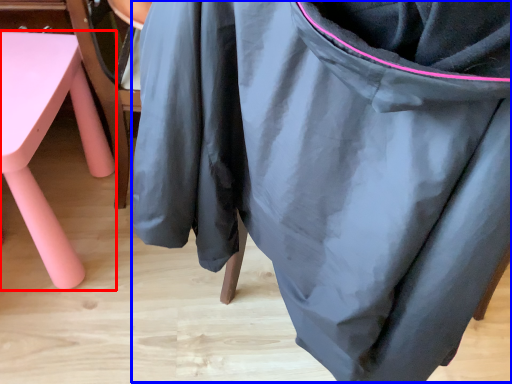
Question: Which point is closer to the camera, furniture (highlighted by a red box) or bean bag chair (highlighted by a blue box)?

Choices:
 (A) furniture
 (B) bean bag chair

Answer: (B)